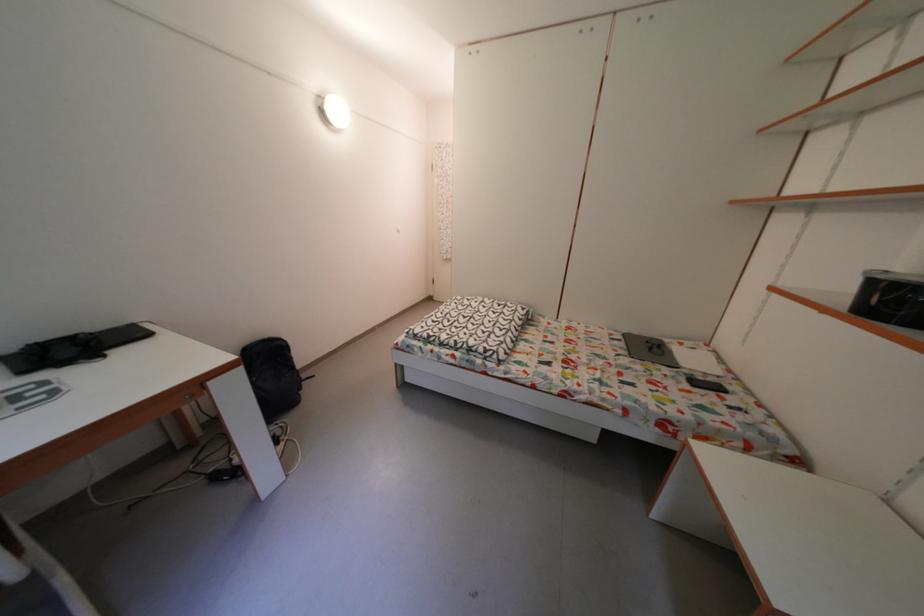
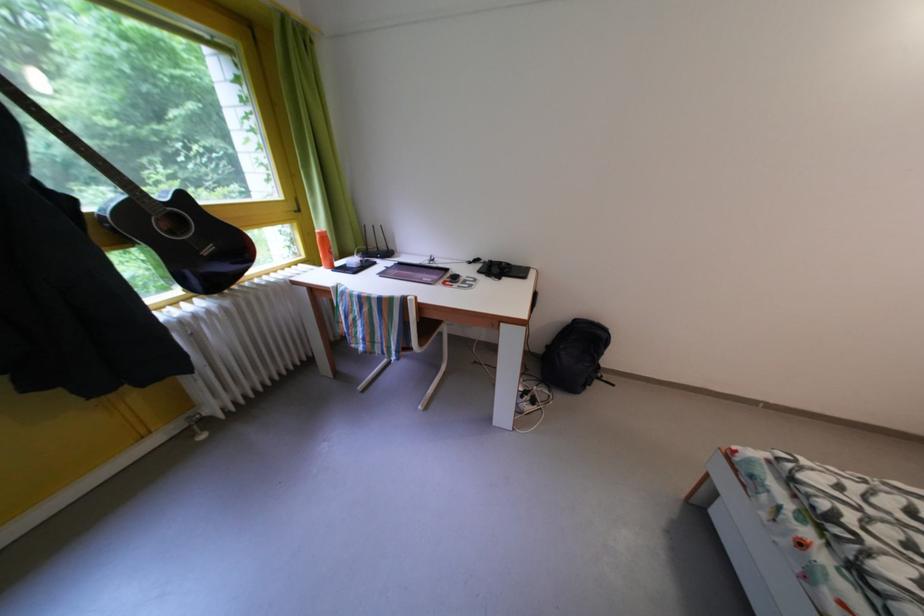
How did the camera likely rotate?

The rotation direction of the camera is left-down.